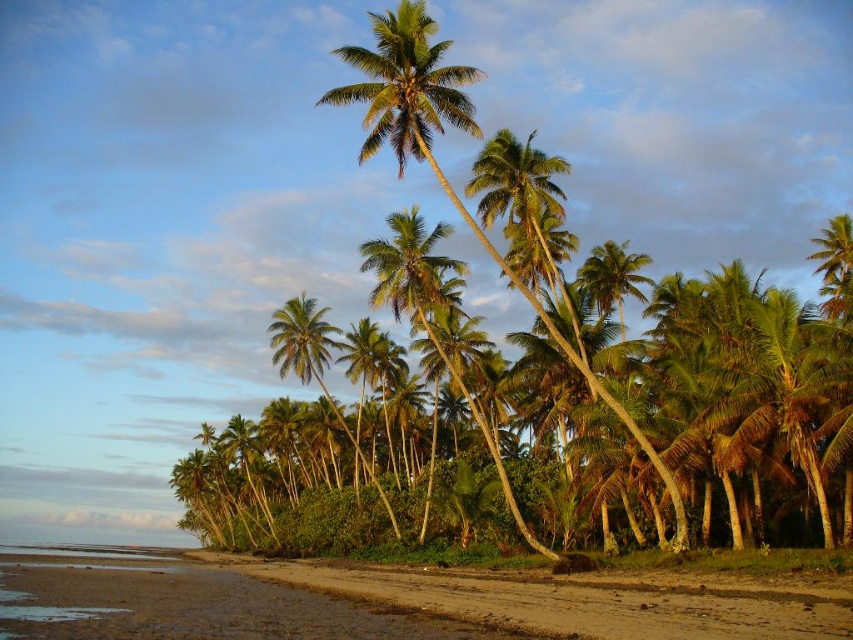
Locate an element on the screen. green leafy coconut tree at center is located at coordinates (616, 291).

Is green leafy coconut tree at center bigger than brown sandy beach at lower left?

Correct, green leafy coconut tree at center is larger in size than brown sandy beach at lower left.

Is point (495, 173) closer to camera compared to point (457, 570)?

Yes, point (495, 173) is in front of point (457, 570).

Identify the location of green leafy coconut tree at center. (616, 291).